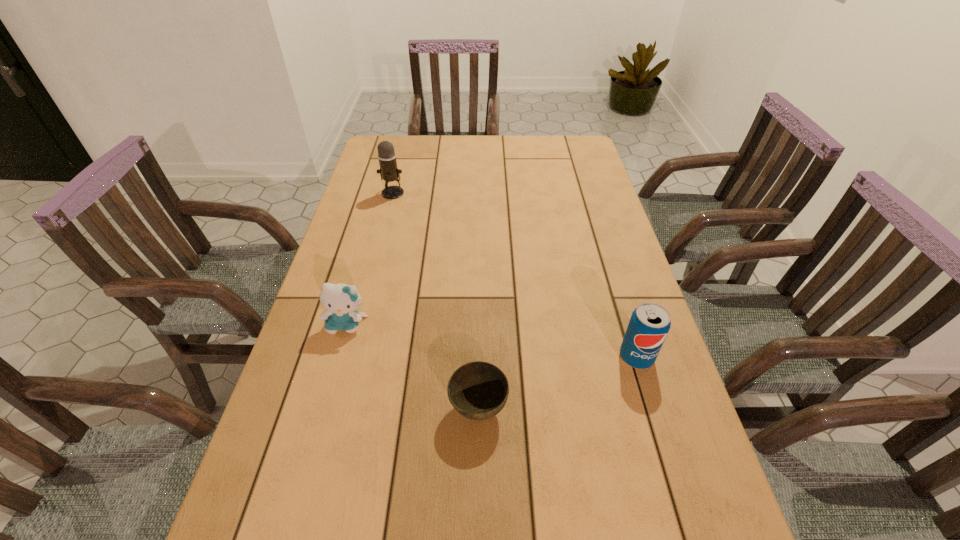
In order to click on vacant space situated 0.050m on the front of the nearest object in this screenshot , I will do `click(478, 461)`.

Image resolution: width=960 pixels, height=540 pixels. I want to click on microphone at the left edge, so click(x=389, y=172).

Identify the location of kitten positioned at the left edge. (342, 301).

Where is `object at the right edge`? This screenshot has width=960, height=540. object at the right edge is located at coordinates (649, 324).

In order to click on free region at the far edge in this screenshot , I will do `click(431, 161)`.

The height and width of the screenshot is (540, 960). Identify the location of free region at the left edge. (339, 244).

The width and height of the screenshot is (960, 540). In the image, there is a desktop. What are the coordinates of `vacant space at the right edge` in the screenshot? It's located at (596, 198).

Where is `empty location between the farthest object and the shortest object`? empty location between the farthest object and the shortest object is located at coordinates (436, 301).

What are the coordinates of `vacant region between the soda can and the tallest object` in the screenshot? It's located at (515, 275).

Where is `empty location between the microphone and the second farthest object`? Image resolution: width=960 pixels, height=540 pixels. empty location between the microphone and the second farthest object is located at coordinates 370,259.